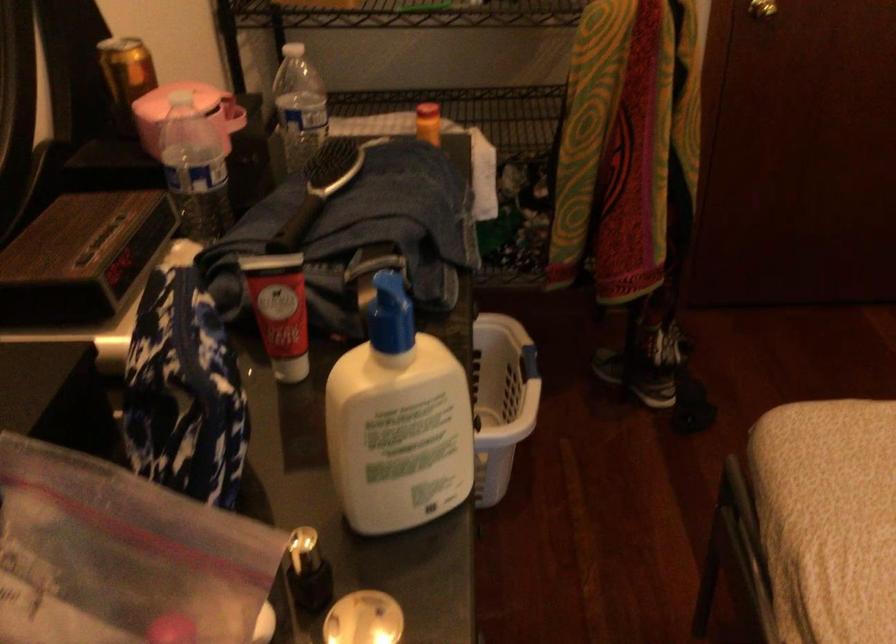
Describe the element at coordinates (391, 314) in the screenshot. Image resolution: width=896 pixels, height=644 pixels. I see `a blue lotion pump` at that location.